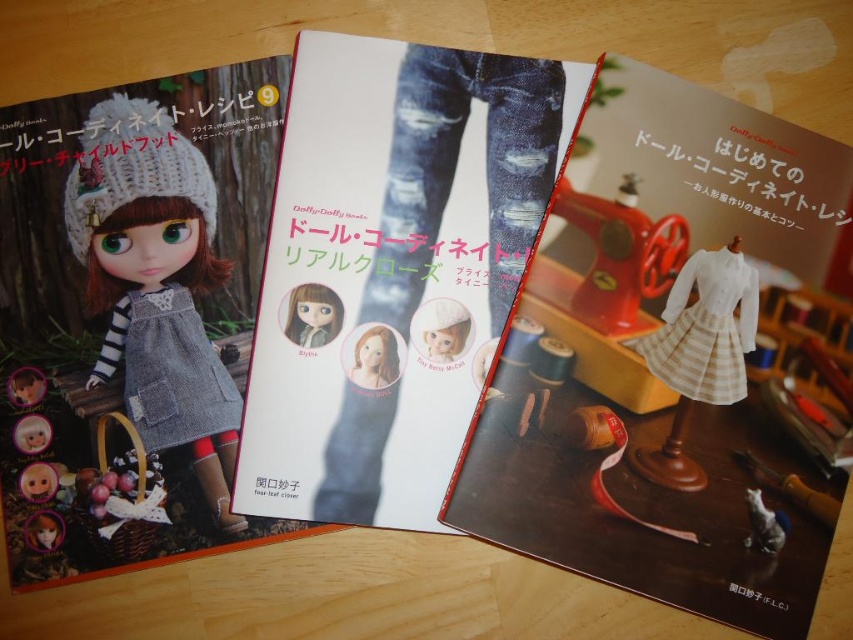
In the scene shown: You are a costume designer preparing for a doll fashion show. You have two outfits to choose from on the center book of the three open books on the wooden surface. The outfits are the striped fabric dress at center and the denim jeans at center. Which outfit takes up more space on the page?

The striped fabric dress at center is bigger than the denim jeans at center, so it takes up more space on the page.

You are looking at the three open books on the wooden surface. There are two points marked on the books. One is at coordinate point (831, 166) and the other is at point (404, 150). Which point is closer to you?

Point (831, 166) is closer to the viewer than point (404, 150).